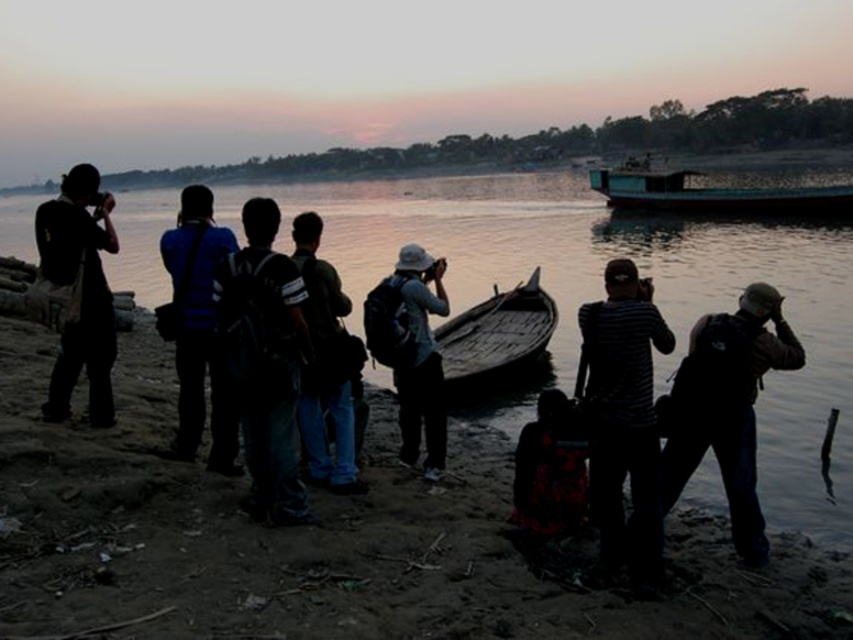
Question: Does matte gray hat at center have a smaller size compared to teal matte boat at upper right?

Choices:
 (A) no
 (B) yes

Answer: (B)

Question: Among these objects, which one is farthest from the camera?

Choices:
 (A) black backpack at center
 (B) matte gray hat at center
 (C) denim jeans at center
 (D) dark brown backpack at right

Answer: (B)

Question: Which of the following is the farthest from the observer?

Choices:
 (A) wooden canoe at center
 (B) brown dirt shoreline at lower left
 (C) blue fabric backpack at center

Answer: (A)

Question: Does black backpack at center have a smaller size compared to wooden canoe at center?

Choices:
 (A) yes
 (B) no

Answer: (A)

Question: Can you confirm if dark brown backpack at right is thinner than matte gray hat at center?

Choices:
 (A) no
 (B) yes

Answer: (A)

Question: Which point appears closest to the camera in this image?

Choices:
 (A) (427, 264)
 (B) (831, 200)
 (C) (61, 564)

Answer: (C)